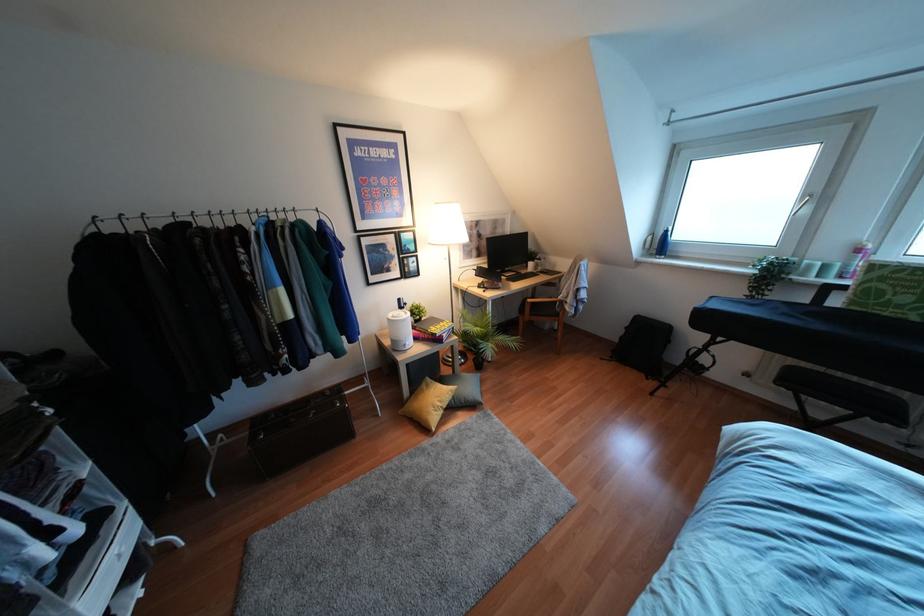
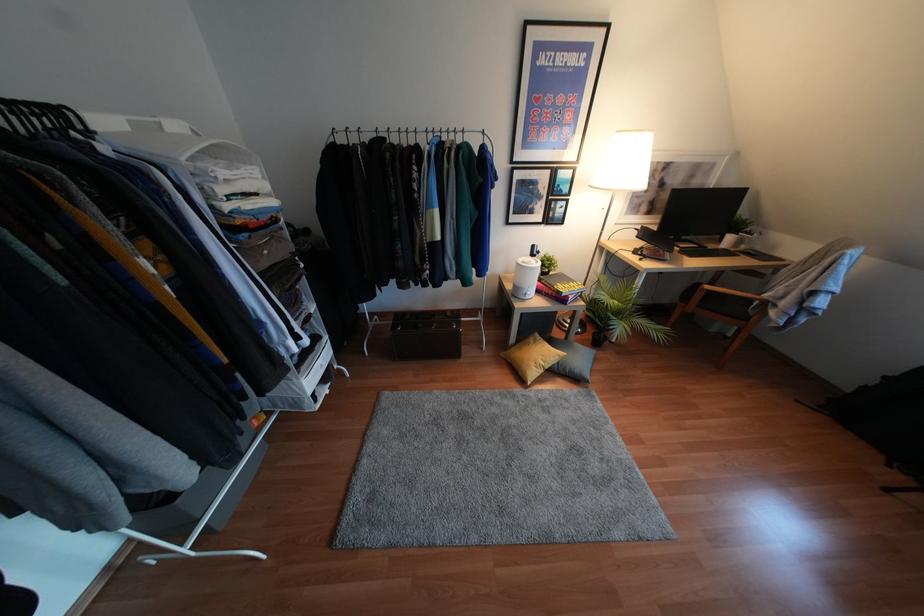
In the second image, find the point that corresponds to (407,347) in the first image.

(526, 297)